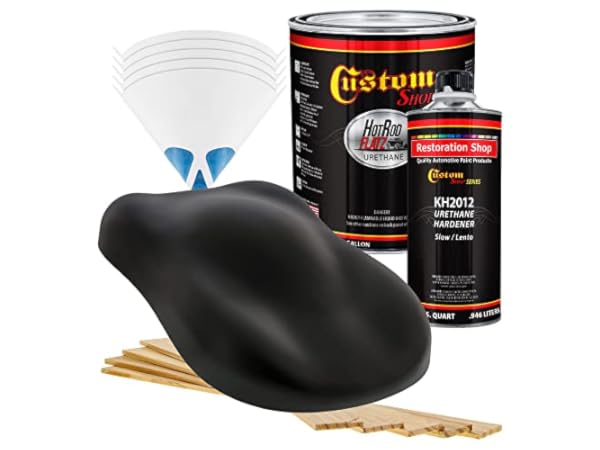
You are a GUI agent. You are given a task and a screenshot of the screen. Output one action in this format:
    pyautogui.click(x=<x>, y=<y>)
    Task: Click on the trim
    The image size is (600, 450).
    Given the screenshot: What is the action you would take?
    tap(360, 45), tap(382, 239), tap(463, 120), tap(480, 305)